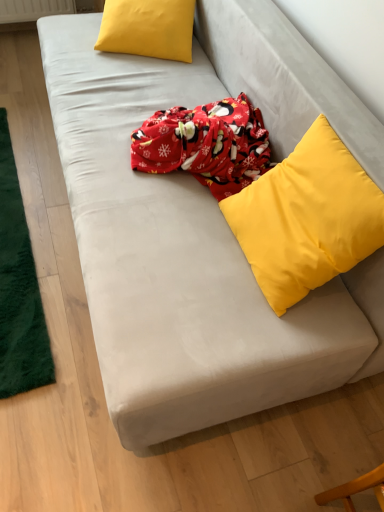
Image resolution: width=384 pixels, height=512 pixels. Find the location of `blank area beneath green plush mat at left (from a real-world perspective)`. blank area beneath green plush mat at left (from a real-world perspective) is located at coordinates (13, 247).